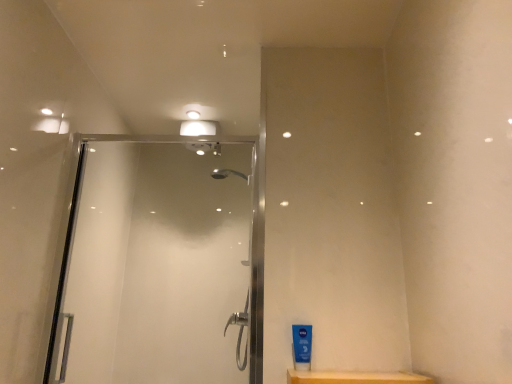
Identify the location of blue plastic tube at lower right. Image resolution: width=512 pixels, height=384 pixels. (302, 347).

Image resolution: width=512 pixels, height=384 pixels. Describe the element at coordinates (302, 347) in the screenshot. I see `blue plastic tube at lower right` at that location.

Measure the distance between clear glass shower door at center and camera.

clear glass shower door at center and camera are 5.40 feet apart from each other.

The width and height of the screenshot is (512, 384). What do you see at coordinates (155, 262) in the screenshot? I see `clear glass shower door at center` at bounding box center [155, 262].

Image resolution: width=512 pixels, height=384 pixels. In order to click on clear glass shower door at center in this screenshot , I will do `click(155, 262)`.

The width and height of the screenshot is (512, 384). What are the coordinates of `blue plastic tube at lower right` in the screenshot? It's located at (302, 347).

Between clear glass shower door at center and blue plastic tube at lower right, which one appears on the left side from the viewer's perspective?

From the viewer's perspective, clear glass shower door at center appears more on the left side.

Which object is closer to the camera taking this photo, clear glass shower door at center or blue plastic tube at lower right?

blue plastic tube at lower right is in front.

Based on the photo, which point is more forward, (112, 380) or (307, 335)?

The point (307, 335) is closer to the camera.

From the image's perspective, does clear glass shower door at center appear higher than blue plastic tube at lower right?

Yes.

From a real-world perspective, is clear glass shower door at center on top of blue plastic tube at lower right?

Correct, in the physical world, clear glass shower door at center is higher than blue plastic tube at lower right.

In terms of width, does clear glass shower door at center look wider or thinner when compared to blue plastic tube at lower right?

Considering their sizes, clear glass shower door at center looks broader than blue plastic tube at lower right.

Can you confirm if clear glass shower door at center is shorter than blue plastic tube at lower right?

Incorrect, the height of clear glass shower door at center does not fall short of that of blue plastic tube at lower right.

Who is smaller, clear glass shower door at center or blue plastic tube at lower right?

blue plastic tube at lower right.

Would you say blue plastic tube at lower right is part of clear glass shower door at center's contents?

No.

Consider the image. Is clear glass shower door at center directly adjacent to blue plastic tube at lower right?

clear glass shower door at center is not next to blue plastic tube at lower right, and they're not touching.

Could you tell me if clear glass shower door at center is facing blue plastic tube at lower right?

No, clear glass shower door at center is not turned towards blue plastic tube at lower right.

What's the angular difference between clear glass shower door at center and blue plastic tube at lower right's facing directions?

They differ by 3.79 degrees in their facing directions.

Measure the distance between clear glass shower door at center and blue plastic tube at lower right.

3.97 feet.

Find the location of a particular element. The image size is (512, 384). toiletry below the clear glass shower door at center (from the image's perspective) is located at coordinates (302, 347).

Based on their positions, is blue plastic tube at lower right located to the left or right of clear glass shower door at center?

In the image, blue plastic tube at lower right appears on the right side of clear glass shower door at center.

In the image, is blue plastic tube at lower right positioned in front of or behind clear glass shower door at center?

blue plastic tube at lower right is in front of clear glass shower door at center.

Is point (294, 364) farther from viewer compared to point (178, 153)?

No, it is in front of (178, 153).

From the image's perspective, is blue plastic tube at lower right on top of clear glass shower door at center?

No, from the image's perspective, blue plastic tube at lower right is not on top of clear glass shower door at center.

From a real-world perspective, is blue plastic tube at lower right positioned under clear glass shower door at center based on gravity?

Correct, in the physical world, blue plastic tube at lower right is lower than clear glass shower door at center.

From the picture: Can you confirm if blue plastic tube at lower right is thinner than clear glass shower door at center?

Correct, the width of blue plastic tube at lower right is less than that of clear glass shower door at center.

Who is shorter, blue plastic tube at lower right or clear glass shower door at center?

Standing shorter between the two is blue plastic tube at lower right.

Can you confirm if blue plastic tube at lower right is bigger than clear glass shower door at center?

Actually, blue plastic tube at lower right might be smaller than clear glass shower door at center.

Can we say blue plastic tube at lower right lies outside clear glass shower door at center?

Indeed, blue plastic tube at lower right is completely outside clear glass shower door at center.

Is blue plastic tube at lower right in contact with clear glass shower door at center?

There is a gap between blue plastic tube at lower right and clear glass shower door at center.

Does blue plastic tube at lower right turn towards clear glass shower door at center?

No.

What's the angular difference between blue plastic tube at lower right and clear glass shower door at center's facing directions?

The facing directions of blue plastic tube at lower right and clear glass shower door at center are 3.79 degrees apart.

Image resolution: width=512 pixels, height=384 pixels. I want to click on screen door above the blue plastic tube at lower right (from the image's perspective), so click(x=155, y=262).

Identify the location of screen door above the blue plastic tube at lower right (from a real-world perspective). (155, 262).

The image size is (512, 384). In order to click on toiletry below the clear glass shower door at center (from a real-world perspective) in this screenshot , I will do `click(302, 347)`.